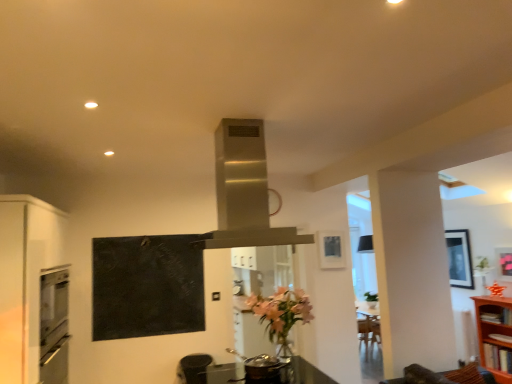
Question: Would you say black matte chalkboard at upper left is inside or outside matte white oven at left?

Choices:
 (A) inside
 (B) outside

Answer: (B)

Question: From a real-world perspective, is black matte chalkboard at upper left positioned above or below matte white oven at left?

Choices:
 (A) below
 (B) above

Answer: (B)

Question: Which object is the closest to the black matte chalkboard at upper left?

Choices:
 (A) matte black picture frame at upper right, the second picture frame from the back
 (B) matte black picture frame at upper center, which ranks as the first picture frame in front-to-back order
 (C) matte black trash can at lower center
 (D) matte white oven at left
 (E) wooden bookshelf at right, acting as the first shelf starting from the bottom

Answer: (D)

Question: Considering the real-world distances, which object is farthest from the black matte chalkboard at upper left?

Choices:
 (A) stainless steel exhaust hood at center
 (B) matte black picture frame at upper center, which ranks as the first picture frame in front-to-back order
 (C) matte black picture frame at upper right, acting as the 1th picture frame starting from the right
 (D) wooden bookshelf at right, acting as the first shelf starting from the bottom
 (E) matte black picture frame at right, which is the third picture frame in front-to-back order

Answer: (C)